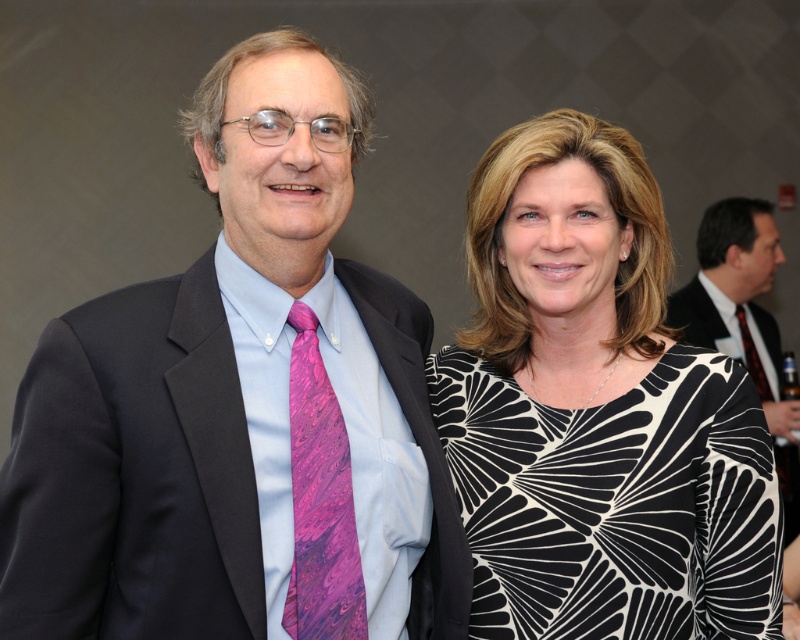
Question: Does purple marbled tie at center have a lesser width compared to pink silk tie at right?

Choices:
 (A) yes
 (B) no

Answer: (A)

Question: Considering the relative positions of matte black suit at center and purple marbled tie at center in the image provided, where is matte black suit at center located with respect to purple marbled tie at center?

Choices:
 (A) right
 (B) left

Answer: (B)

Question: Can you confirm if purple marbled tie at center is thinner than black silk business suit at right?

Choices:
 (A) no
 (B) yes

Answer: (B)

Question: Considering the real-world distances, which object is farthest from the black printed dress at right?

Choices:
 (A) purple marbled tie at center
 (B) matte black suit at center
 (C) black silk business suit at right

Answer: (C)

Question: Which object appears closest to the camera in this image?

Choices:
 (A) black printed dress at right
 (B) black silk business suit at right
 (C) purple marbled tie at center
 (D) pink silk tie at right

Answer: (C)

Question: Which object is closer to the camera taking this photo?

Choices:
 (A) black silk business suit at right
 (B) pink silk tie at right
 (C) purple marbled tie at center
 (D) black printed dress at right

Answer: (C)